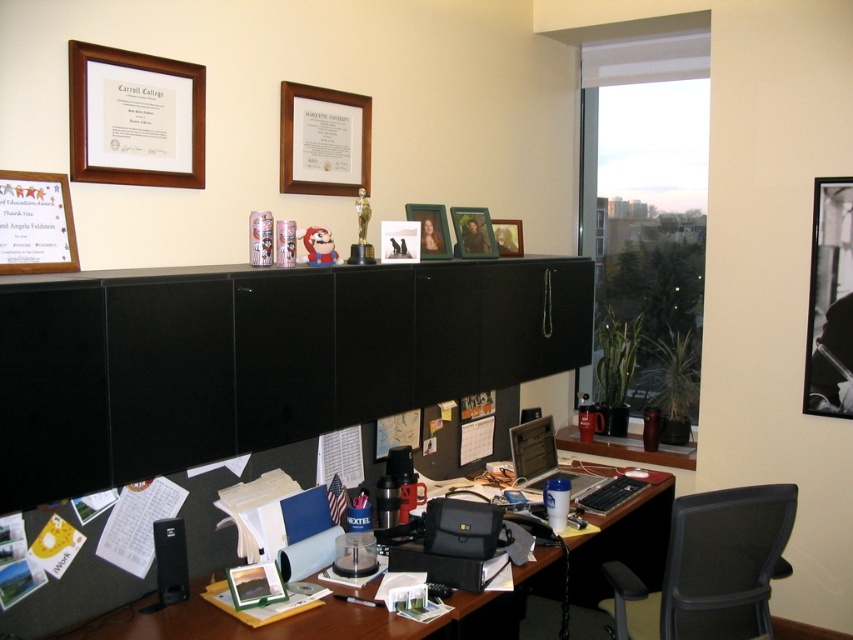
Is black matte/file cabinet at center shorter than black glossy picture frame at upper right?

Yes, black matte/file cabinet at center is shorter than black glossy picture frame at upper right.

Is black matte/file cabinet at center positioned at the back of black glossy picture frame at upper right?

No, it is in front of black glossy picture frame at upper right.

This screenshot has height=640, width=853. Find the location of `black matte/file cabinet at center`. black matte/file cabinet at center is located at coordinates (258, 358).

In order to click on black matte/file cabinet at center in this screenshot , I will do `click(258, 358)`.

How distant is wooden photo frame at upper center from wooden photo frame at center?

A distance of 5.53 inches exists between wooden photo frame at upper center and wooden photo frame at center.

Which is behind, point (468, 216) or point (424, 218)?

The point (468, 216) is more distant.

Measure the distance between point (457,234) and camera.

9.87 feet

The image size is (853, 640). I want to click on wooden photo frame at upper center, so click(473, 232).

How distant is black glossy picture frame at upper right from wooden photo frame at upper center?

1.43 meters

Locate an element on the screen. The height and width of the screenshot is (640, 853). black glossy picture frame at upper right is located at coordinates (830, 301).

What do you see at coordinates (830, 301) in the screenshot? The width and height of the screenshot is (853, 640). I see `black glossy picture frame at upper right` at bounding box center [830, 301].

Image resolution: width=853 pixels, height=640 pixels. Identify the location of black glossy picture frame at upper right. (830, 301).